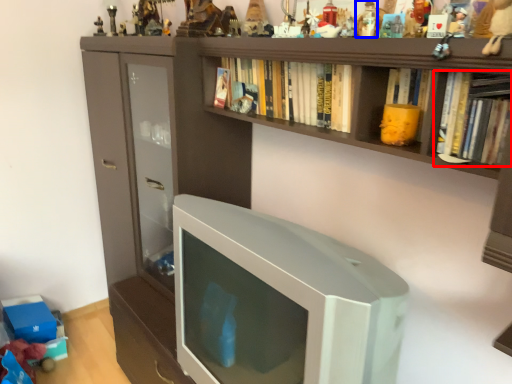
Question: Which object appears farthest to the camera in this image, book (highlighted by a red box) or toy (highlighted by a blue box)?

Choices:
 (A) book
 (B) toy

Answer: (B)